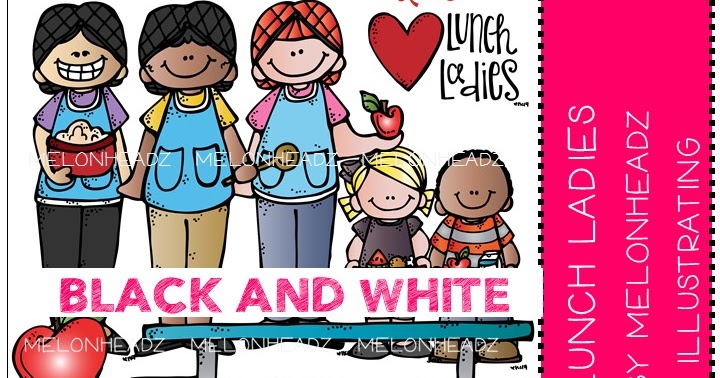
Find the location of a particular element. Image resolution: width=720 pixels, height=378 pixels. bowl is located at coordinates (81, 160).